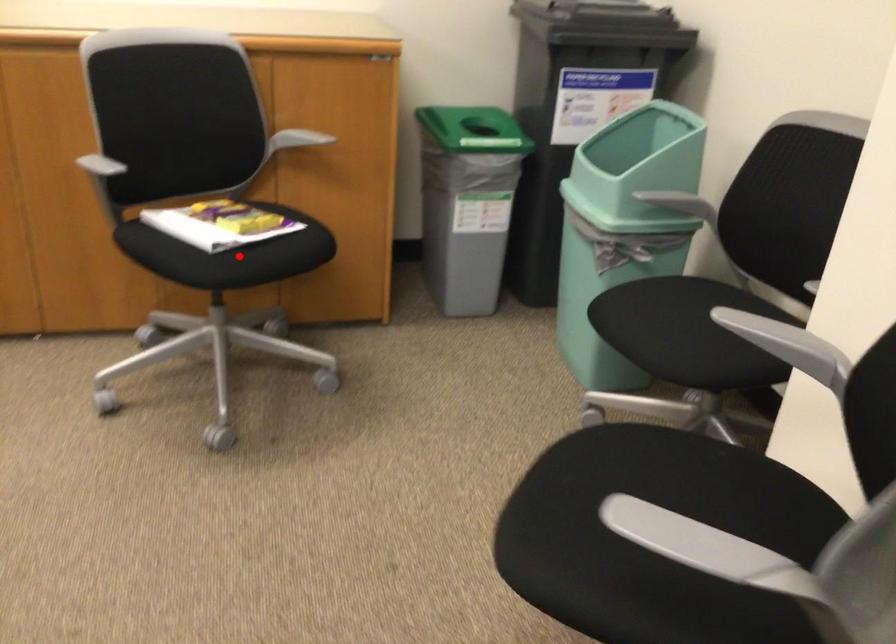
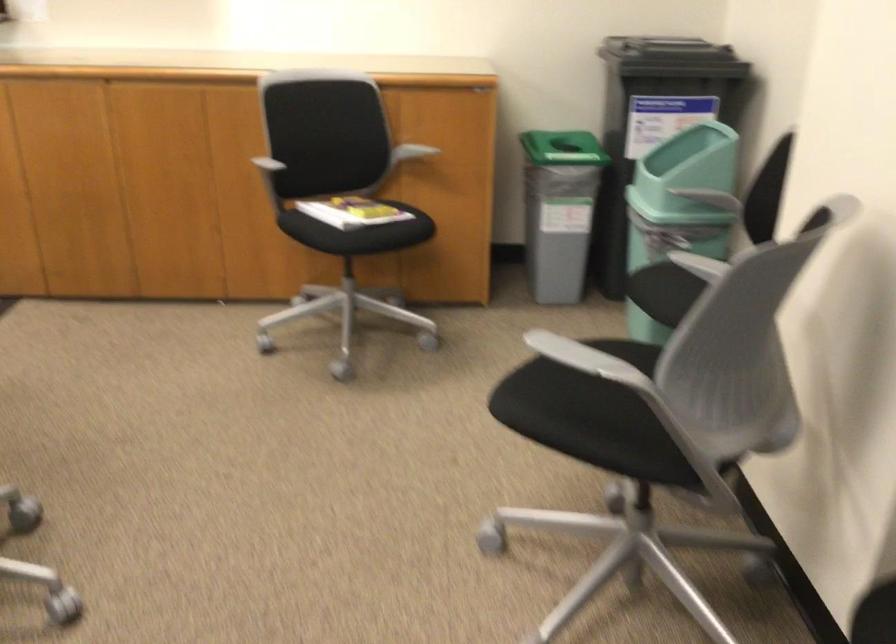
Where in the second image is the point corresponding to the highlighted location from the first image?

(358, 232)